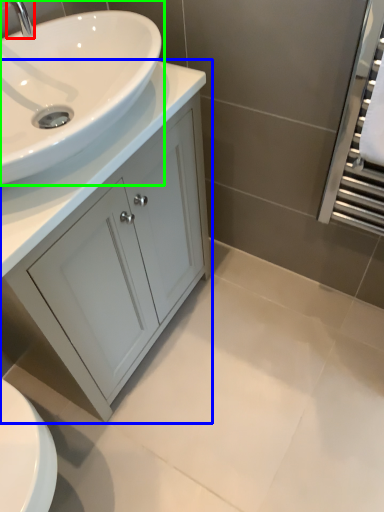
Question: Estimate the real-world distances between objects in this image. Which object is farther from tap (highlighted by a red box), bathroom cabinet (highlighted by a blue box) or sink (highlighted by a green box)?

Choices:
 (A) bathroom cabinet
 (B) sink

Answer: (A)